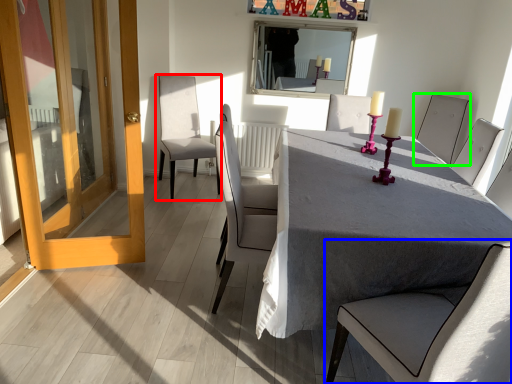
Question: Which is nearer to the chair (highlighted by a red box)? chair (highlighted by a blue box) or chair (highlighted by a green box).

Choices:
 (A) chair
 (B) chair

Answer: (B)